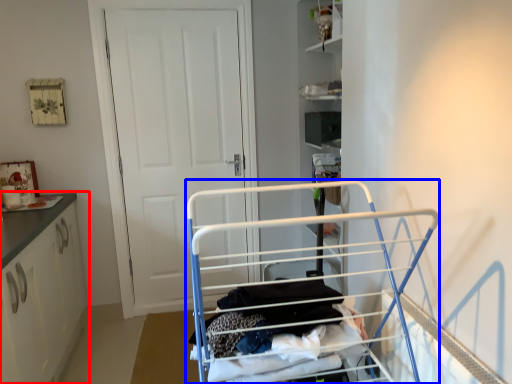
Question: Which of the following is the farthest to the observer, cabinetry (highlighted by a red box) or baby carriage (highlighted by a blue box)?

Choices:
 (A) cabinetry
 (B) baby carriage

Answer: (A)